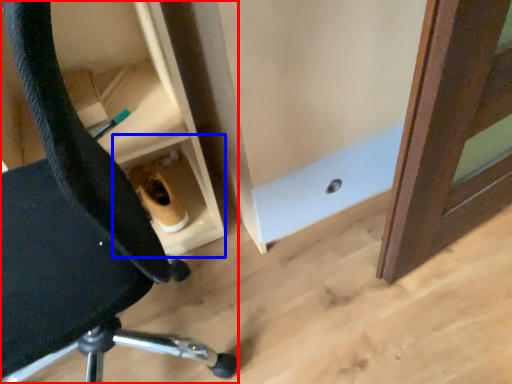
Question: Which of the following is the closest to the observer, chair (highlighted by a red box) or cabinetry (highlighted by a blue box)?

Choices:
 (A) chair
 (B) cabinetry

Answer: (A)